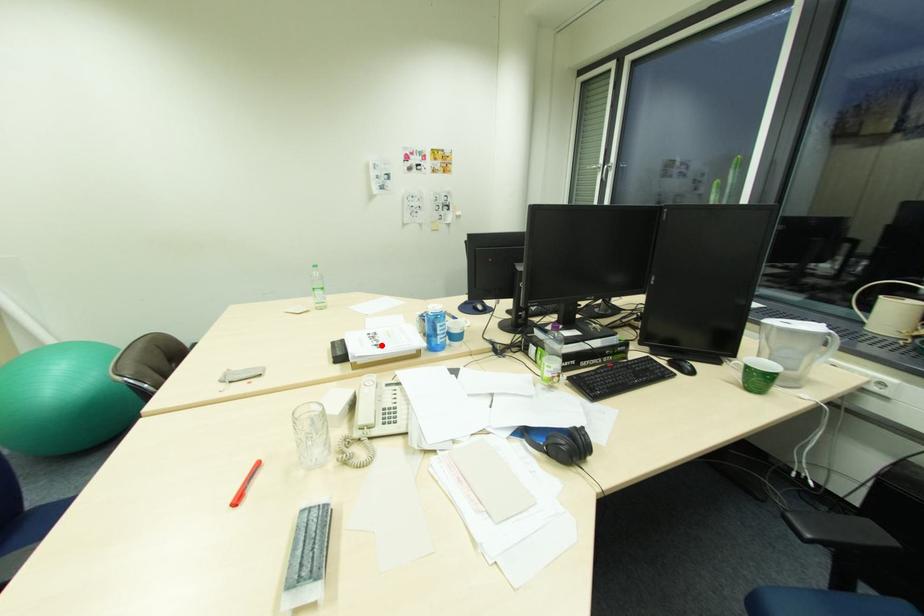
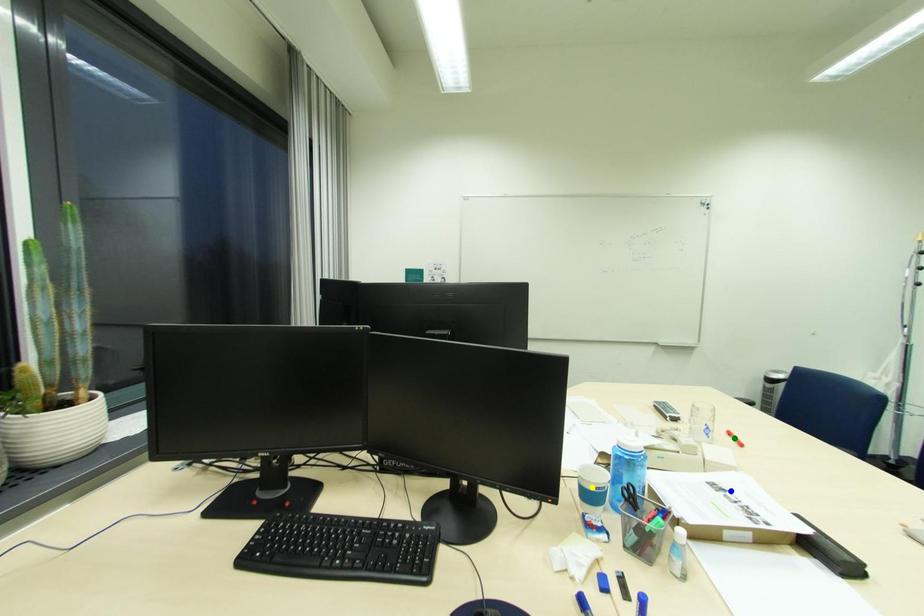
Question: I am providing you with two images of the same scene from different viewpoints. A red point is marked on the first image. You are given multiple points on the second image. Which spot in image 2 lines up with the point in image 1?

Choices:
 (A) yellow point
 (B) blue point
 (C) green point

Answer: (B)